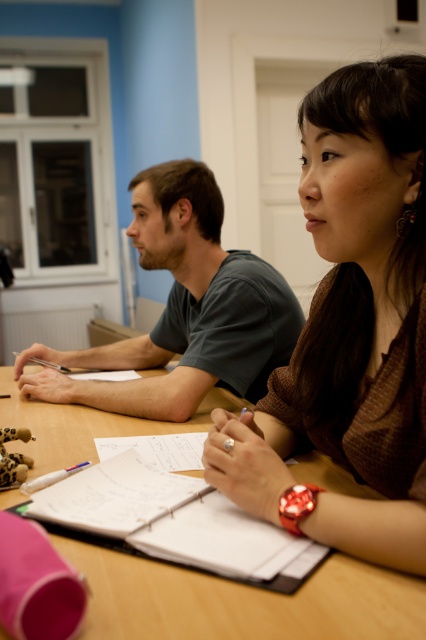
Measure the distance between matte brown shirt at center and camera.

They are 23.89 inches apart.

Measure the distance between matte brown shirt at center and camera.

matte brown shirt at center and camera are 60.68 centimeters apart.

Where is `matte brown shirt at center`? matte brown shirt at center is located at coordinates point(351,328).

This screenshot has height=640, width=426. I want to click on matte brown shirt at center, so click(x=351, y=328).

Who is higher up, matte brown shirt at center or white paper notebook at center?

matte brown shirt at center is above.

Between point (408, 241) and point (152, 481), which one is positioned in front?

Point (408, 241) is more forward.

Image resolution: width=426 pixels, height=640 pixels. I want to click on matte brown shirt at center, so click(x=351, y=328).

Is matte gray shirt at center shorter than white paper notebook at center?

Incorrect, matte gray shirt at center's height does not fall short of white paper notebook at center's.

Can you confirm if matte gray shirt at center is wider than white paper notebook at center?

Indeed, matte gray shirt at center has a greater width compared to white paper notebook at center.

Is point (169, 416) in front of point (91, 504)?

No, it is behind (91, 504).

This screenshot has width=426, height=640. Find the location of `matte gray shirt at center`. matte gray shirt at center is located at coordinates (184, 308).